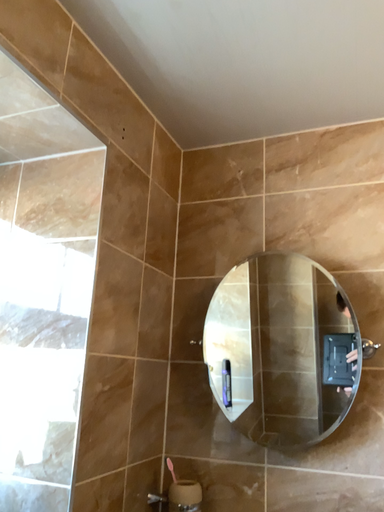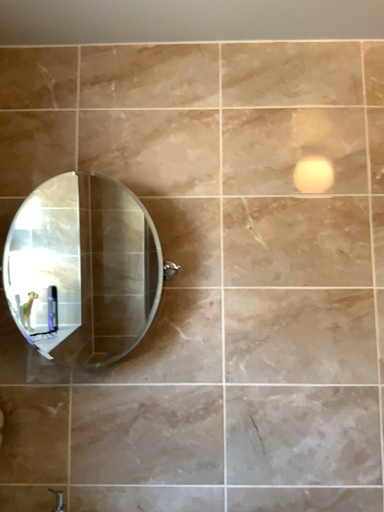
Question: How did the camera likely rotate when shooting the video?

Choices:
 (A) rotated left
 (B) rotated right

Answer: (B)